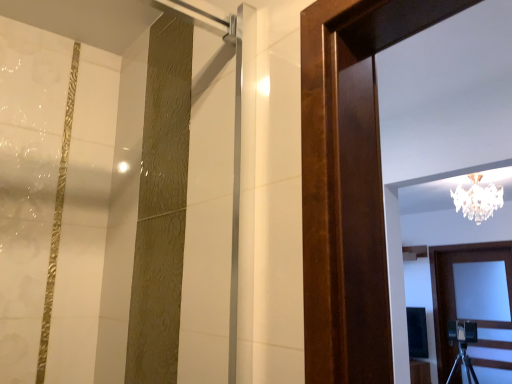
Question: Is white wooden door at lower right outside of clear crystal chandelier at upper center?

Choices:
 (A) yes
 (B) no

Answer: (A)

Question: Is white wooden door at lower right in front of clear crystal chandelier at upper center?

Choices:
 (A) no
 (B) yes

Answer: (A)

Question: Is clear crystal chandelier at upper center located within white wooden door at lower right?

Choices:
 (A) yes
 (B) no

Answer: (B)

Question: Can you see white wooden door at lower right touching clear crystal chandelier at upper center?

Choices:
 (A) no
 (B) yes

Answer: (A)

Question: Can you confirm if white wooden door at lower right is wider than clear crystal chandelier at upper center?

Choices:
 (A) yes
 (B) no

Answer: (B)

Question: Does white wooden door at lower right have a lesser height compared to clear crystal chandelier at upper center?

Choices:
 (A) no
 (B) yes

Answer: (A)

Question: From a real-world perspective, is clear crystal chandelier at upper center positioned over white wooden door at lower right based on gravity?

Choices:
 (A) yes
 (B) no

Answer: (A)

Question: Are clear crystal chandelier at upper center and white wooden door at lower right far apart?

Choices:
 (A) yes
 (B) no

Answer: (A)

Question: Is clear crystal chandelier at upper center taller than white wooden door at lower right?

Choices:
 (A) yes
 (B) no

Answer: (B)

Question: From the image's perspective, is clear crystal chandelier at upper center located above white wooden door at lower right?

Choices:
 (A) no
 (B) yes

Answer: (B)

Question: Considering the relative sizes of clear crystal chandelier at upper center and white wooden door at lower right in the image provided, is clear crystal chandelier at upper center thinner than white wooden door at lower right?

Choices:
 (A) yes
 (B) no

Answer: (B)

Question: Can you confirm if clear crystal chandelier at upper center is shorter than white wooden door at lower right?

Choices:
 (A) no
 (B) yes

Answer: (B)

Question: Looking at their shapes, would you say clear crystal chandelier at upper center is wider or thinner than white wooden door at lower right?

Choices:
 (A) thin
 (B) wide

Answer: (B)